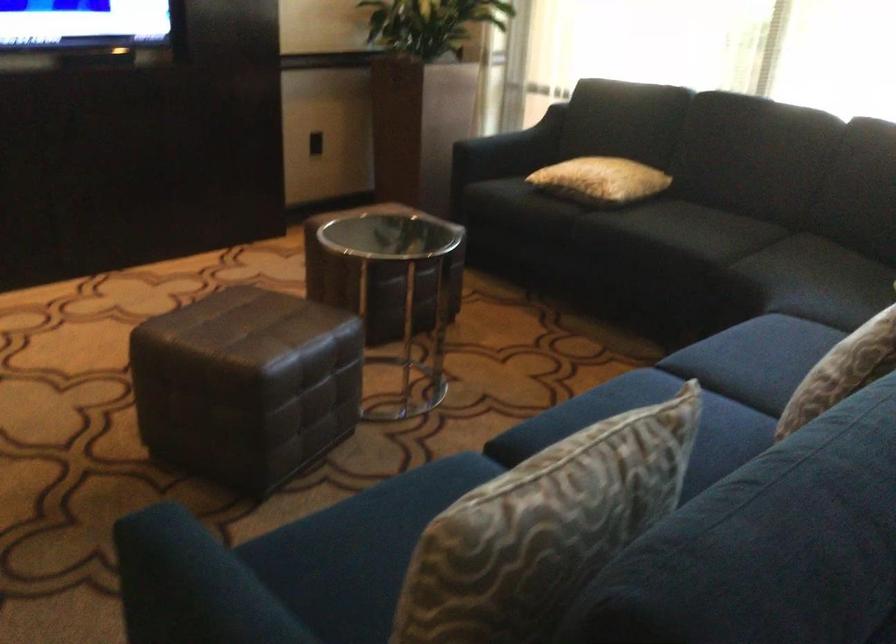
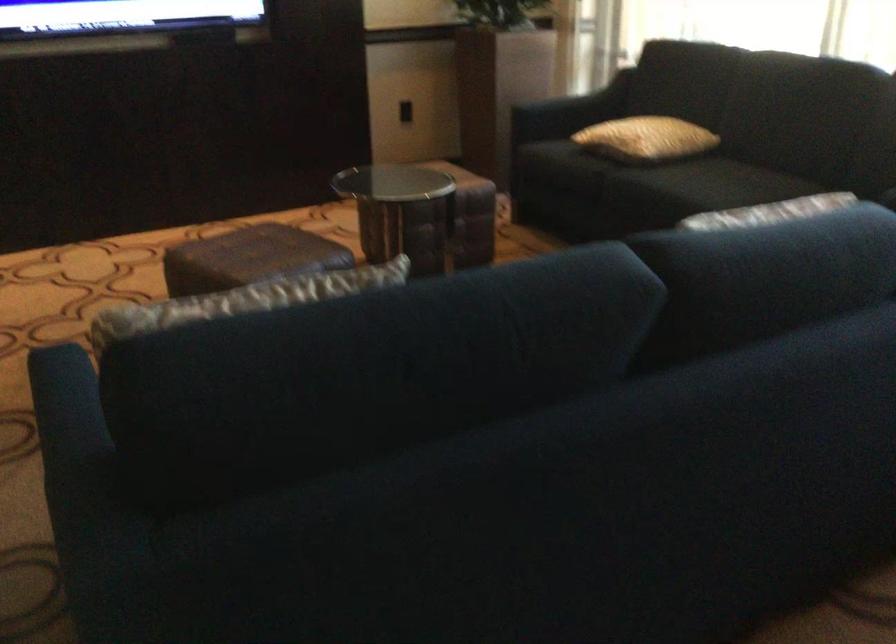
Question: Based on the continuous images, in which direction is the camera rotating? Reply with the corresponding letter.

Choices:
 (A) Left
 (B) Right
 (C) Up
 (D) Down

Answer: (A)